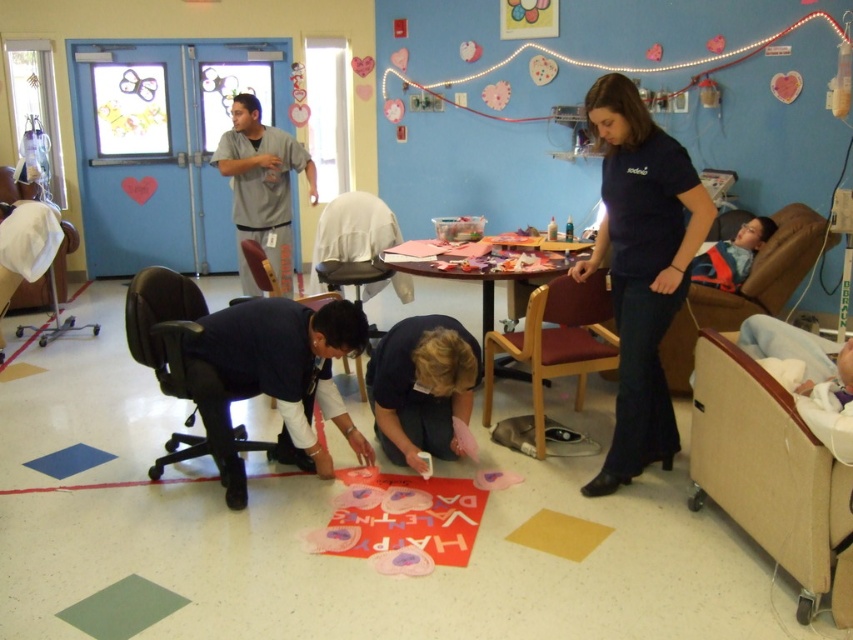
Question: Does dark blue shirt at center appear under gray scrubs at center?

Choices:
 (A) no
 (B) yes

Answer: (B)

Question: Does beige fabric hospital bed at lower right appear under gray scrubs at center?

Choices:
 (A) yes
 (B) no

Answer: (A)

Question: Among these objects, which one is farthest from the camera?

Choices:
 (A) wooden table at center
 (B) gray scrubs at center
 (C) white fabric chair at left

Answer: (B)

Question: Is beige fabric hospital bed at lower right smaller than black fabric armchair at lower center?

Choices:
 (A) yes
 (B) no

Answer: (A)

Question: Which point is farther from the camera taking this photo?

Choices:
 (A) (10, 244)
 (B) (148, 312)

Answer: (A)

Question: Considering the real-world distances, which object is closest to the black fabric armchair at lower center?

Choices:
 (A) beige fabric hospital bed at lower right
 (B) wooden armchair at center
 (C) dark blue shirt at center

Answer: (B)